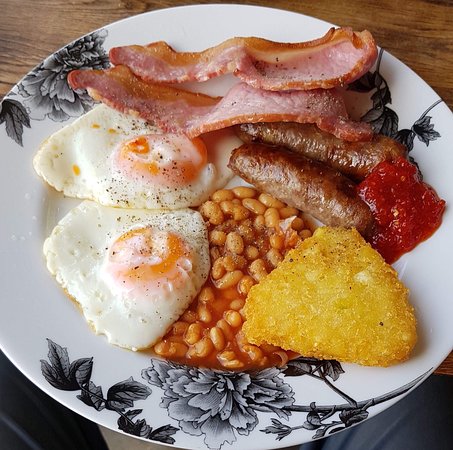
The width and height of the screenshot is (453, 450). I want to click on wood table, so click(24, 35), click(413, 34).